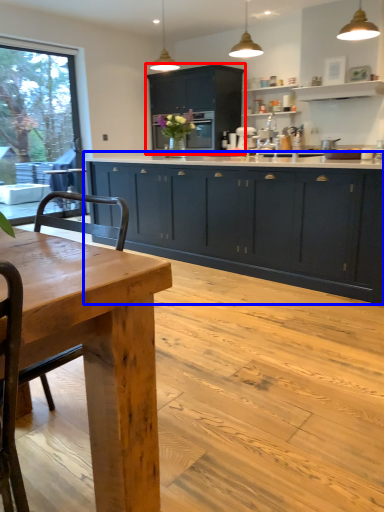
Question: Which of the following is the closest to the observer, cabinetry (highlighted by a red box) or cabinetry (highlighted by a blue box)?

Choices:
 (A) cabinetry
 (B) cabinetry

Answer: (B)